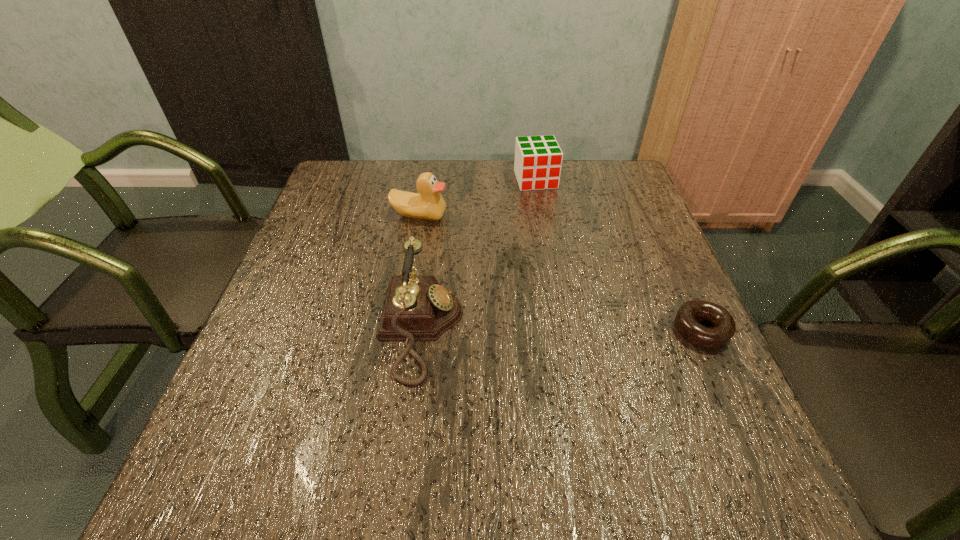
Find the location of a particular element. vacant space on the desktop that is between the telephone and the rightmost object and is positioned at the beak of the duck is located at coordinates (523, 329).

At what (x,y) coordinates should I click in order to perform the action: click on vacant space on the desktop that is between the telephone and the shortest object and is positioned on the red face of the farthest object. Please return your answer as a coordinate pair (x, y). This screenshot has height=540, width=960. Looking at the image, I should click on (592, 329).